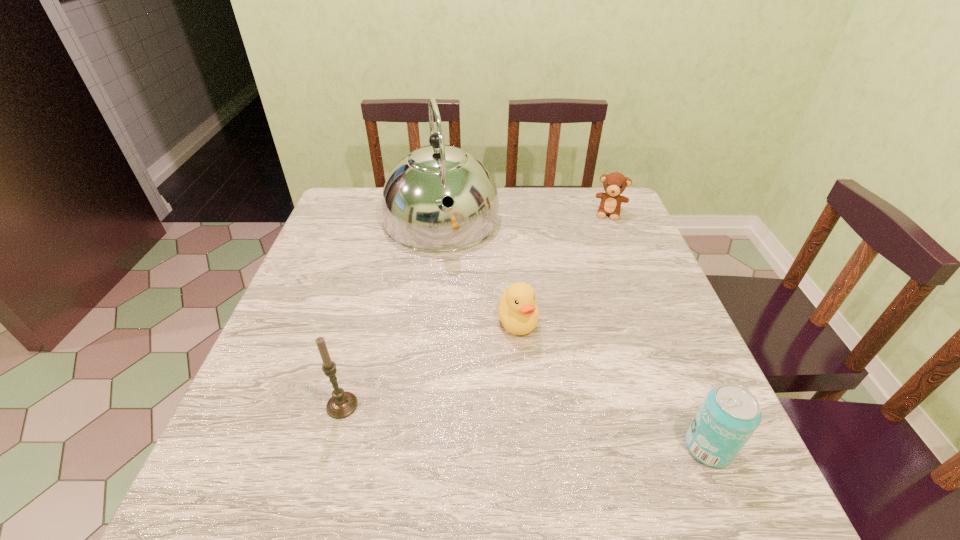
You are a GUI agent. You are given a task and a screenshot of the screen. Output one action in this format:
    pyautogui.click(x=<x>, y=<y>)
    Task: Click on the vacant space located 0.210m on the face of the duckling
    The height and width of the screenshot is (540, 960).
    Given the screenshot: What is the action you would take?
    pyautogui.click(x=540, y=431)

Find the location of `free space located 0.290m from the spout of the kettle`. free space located 0.290m from the spout of the kettle is located at coordinates (468, 343).

Where is `free space located from the spout of the kettle`? This screenshot has height=540, width=960. free space located from the spout of the kettle is located at coordinates (468, 343).

The image size is (960, 540). Find the location of `free spot located 0.220m from the spout of the kettle`. free spot located 0.220m from the spout of the kettle is located at coordinates (463, 320).

Where is `free space located on the face of the teddy bear`? free space located on the face of the teddy bear is located at coordinates (602, 248).

Identify the location of vacant region located 0.230m on the face of the teddy bear. Image resolution: width=960 pixels, height=540 pixels. (597, 268).

This screenshot has height=540, width=960. Identify the location of free spot located 0.250m on the face of the teddy bear. (596, 273).

Identify the location of kettle that is at the far edge. (414, 217).

What are the coordinates of `teddy bear at the far edge` in the screenshot? It's located at (614, 184).

Locate an element on the screen. The height and width of the screenshot is (540, 960). candle present at the near edge is located at coordinates (342, 404).